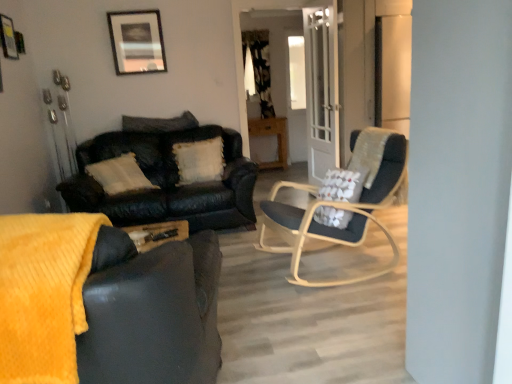
What do you see at coordinates (159, 123) in the screenshot? I see `fluffy white pillow at center, marked as the 1th pillow in a top-to-bottom arrangement` at bounding box center [159, 123].

Image resolution: width=512 pixels, height=384 pixels. I want to click on fluffy white pillow at center, the second pillow when ordered from bottom to top, so click(159, 123).

Describe the element at coordinates (259, 68) in the screenshot. I see `black textured curtain at upper center` at that location.

This screenshot has height=384, width=512. Identify the location of wooden table at center. (271, 134).

This screenshot has height=384, width=512. What do you see at coordinates (321, 91) in the screenshot?
I see `clear glass door at center` at bounding box center [321, 91].

I want to click on matte black couch at lower left, the 1th studio couch viewed from the front, so click(x=105, y=304).

Identify the location of matte black chair at center. (337, 209).

At what (x,y) coordinates should I click in order to perform the action: click on white fluffy pillow at center, the second pillow in the top-to-bottom sequence. Please return your answer as a coordinate pair (x, y). The height and width of the screenshot is (384, 512). Looking at the image, I should click on (199, 160).

Is wooden table at center surrounding white fluffy pillow at center, which is the 1th pillow in bottom-to-top order?

No, wooden table at center does not contain white fluffy pillow at center, which is the 1th pillow in bottom-to-top order.

Measure the distance from wooden table at center to white fluffy pillow at center, the second pillow in the top-to-bottom sequence.

The distance of wooden table at center from white fluffy pillow at center, the second pillow in the top-to-bottom sequence, is 2.23 meters.

Is wooden table at center bigger or smaller than white fluffy pillow at center, the second pillow in the top-to-bottom sequence?

Considering their sizes, wooden table at center takes up more space than white fluffy pillow at center, the second pillow in the top-to-bottom sequence.

Does matte black couch at lower left, the 1th studio couch viewed from the front, appear on the right side of matte black chair at center?

No, matte black couch at lower left, the 1th studio couch viewed from the front, is not to the right of matte black chair at center.

Is the depth of matte black couch at lower left, the 1th studio couch viewed from the front, less than that of matte black chair at center?

Yes, matte black couch at lower left, the 1th studio couch viewed from the front, is closer to the camera.

Can you confirm if matte black couch at lower left, the 1th studio couch viewed from the front, is taller than matte black chair at center?

Indeed, matte black couch at lower left, the 1th studio couch viewed from the front, has a greater height compared to matte black chair at center.

Identify the location of chair on the right side of matte black couch at lower left, the 1th studio couch viewed from the front. Image resolution: width=512 pixels, height=384 pixels. (337, 209).

Is wooden table at center with clear glass door at center?

They are not placed beside each other.

Considering the sizes of wooden table at center and clear glass door at center in the image, is wooden table at center bigger or smaller than clear glass door at center?

In the image, wooden table at center appears to be larger than clear glass door at center.

From a real-world perspective, is wooden table at center beneath clear glass door at center?

Yes, from a real-world perspective, wooden table at center is under clear glass door at center.

Consider the image. Can you confirm if wooden table at center is shorter than clear glass door at center?

Correct, wooden table at center is not as tall as clear glass door at center.

Considering the sizes of objects fluffy white pillow at center, the second pillow when ordered from bottom to top, and wooden table at center in the image provided, who is smaller, fluffy white pillow at center, the second pillow when ordered from bottom to top, or wooden table at center?

Smaller between the two is fluffy white pillow at center, the second pillow when ordered from bottom to top.

Can you confirm if fluffy white pillow at center, the second pillow when ordered from bottom to top, is thinner than wooden table at center?

Indeed, fluffy white pillow at center, the second pillow when ordered from bottom to top, has a lesser width compared to wooden table at center.

Which is more to the left, fluffy white pillow at center, marked as the 1th pillow in a top-to-bottom arrangement, or wooden table at center?

Positioned to the left is fluffy white pillow at center, marked as the 1th pillow in a top-to-bottom arrangement.

Does fluffy white pillow at center, the second pillow when ordered from bottom to top, have a lesser height compared to wooden table at center?

Yes.

From the image's perspective, is clear glass door at center positioned above or below matte black couch at lower left, positioned as the 2th studio couch in back-to-front order?

clear glass door at center is situated higher than matte black couch at lower left, positioned as the 2th studio couch in back-to-front order, in the image.

Which is more to the right, clear glass door at center or matte black couch at lower left, positioned as the 2th studio couch in back-to-front order?

clear glass door at center is more to the right.

Is point (327, 90) positioned in front of point (168, 298)?

No, (327, 90) is behind (168, 298).

How different are the orientations of clear glass door at center and matte black couch at lower left, positioned as the 2th studio couch in back-to-front order, in degrees?

The angle between the facing direction of clear glass door at center and the facing direction of matte black couch at lower left, positioned as the 2th studio couch in back-to-front order, is 107 degrees.

In the image, is white fluffy pillow at center, the second pillow in the top-to-bottom sequence, on the left side or the right side of black textured curtain at upper center?

white fluffy pillow at center, the second pillow in the top-to-bottom sequence, is positioned on black textured curtain at upper center's left side.

Is white fluffy pillow at center, the second pillow in the top-to-bottom sequence, facing towards black textured curtain at upper center?

No, white fluffy pillow at center, the second pillow in the top-to-bottom sequence, is not aimed at black textured curtain at upper center.

Is the position of white fluffy pillow at center, which is the 1th pillow in bottom-to-top order, less distant than that of black textured curtain at upper center?

Yes.

In the scene shown: From a real-world perspective, which object rests below the other?

leather couch at left, marked as the 2th studio couch in a front-to-back arrangement.

Is fluffy white pillow at center, marked as the 1th pillow in a top-to-bottom arrangement, turned away from leather couch at left, marked as the 2th studio couch in a front-to-back arrangement?

fluffy white pillow at center, marked as the 1th pillow in a top-to-bottom arrangement, does not have its back to leather couch at left, marked as the 2th studio couch in a front-to-back arrangement.

Does fluffy white pillow at center, marked as the 1th pillow in a top-to-bottom arrangement, have a greater height compared to leather couch at left, acting as the first studio couch starting from the back?

No.

Would you say fluffy white pillow at center, the second pillow when ordered from bottom to top, contains leather couch at left, marked as the 2th studio couch in a front-to-back arrangement?

No, leather couch at left, marked as the 2th studio couch in a front-to-back arrangement, is not a part of fluffy white pillow at center, the second pillow when ordered from bottom to top.

Locate an element on the screen. The image size is (512, 384). table on the right of the white fluffy pillow at center, the second pillow in the top-to-bottom sequence is located at coordinates (271, 134).

Identify the location of chair behind the matte black couch at lower left, the 1th studio couch viewed from the front. The width and height of the screenshot is (512, 384). (337, 209).

When comparing their distances from matte black chair at center, does leather couch at left, acting as the first studio couch starting from the back, or fluffy white pillow at center, the second pillow when ordered from bottom to top, seem further?

fluffy white pillow at center, the second pillow when ordered from bottom to top, is positioned further to the anchor matte black chair at center.

When comparing their distances from fluffy white pillow at center, marked as the 1th pillow in a top-to-bottom arrangement, does white fluffy pillow at center, which is the 1th pillow in bottom-to-top order, or clear glass door at center seem further?

clear glass door at center is further to fluffy white pillow at center, marked as the 1th pillow in a top-to-bottom arrangement.

From the image, which object appears to be farther from wooden table at center, leather couch at left, acting as the first studio couch starting from the back, or white fluffy pillow at center, which is the 1th pillow in bottom-to-top order?

leather couch at left, acting as the first studio couch starting from the back, lies further to wooden table at center than the other object.

Considering their positions, is clear glass door at center positioned closer to wooden table at center than matte black picture frame at upper center?

clear glass door at center is closer to wooden table at center.

From the image, which object appears to be nearer to matte black couch at lower left, positioned as the 2th studio couch in back-to-front order, matte black picture frame at upper center or clear glass door at center?

clear glass door at center lies closer to matte black couch at lower left, positioned as the 2th studio couch in back-to-front order, than the other object.

From the image, which object appears to be farther from matte black picture frame at upper center, fluffy white pillow at center, marked as the 1th pillow in a top-to-bottom arrangement, or white fluffy pillow at center, which is the 1th pillow in bottom-to-top order?

Among the two, white fluffy pillow at center, which is the 1th pillow in bottom-to-top order, is located further to matte black picture frame at upper center.

Which object lies further to the anchor point leather couch at left, marked as the 2th studio couch in a front-to-back arrangement, wooden table at center or matte black chair at center?

Based on the image, wooden table at center appears to be further to leather couch at left, marked as the 2th studio couch in a front-to-back arrangement.

Which object lies nearer to the anchor point black textured curtain at upper center, wooden table at center or clear glass door at center?

Among the two, wooden table at center is located nearer to black textured curtain at upper center.

At what (x,y) coordinates should I click in order to perform the action: click on chair between matte black couch at lower left, positioned as the 2th studio couch in back-to-front order, and matte black picture frame at upper center in the front-back direction. Please return your answer as a coordinate pair (x, y). Looking at the image, I should click on (337, 209).

I want to click on curtain between matte black chair at center and wooden table at center in the front-back direction, so click(259, 68).

Locate an element on the screen. This screenshot has width=512, height=384. curtain between fluffy white pillow at center, the second pillow when ordered from bottom to top, and wooden table at center in the front-back direction is located at coordinates (259, 68).

This screenshot has height=384, width=512. In order to click on curtain between matte black picture frame at upper center and wooden table at center from front to back in this screenshot , I will do `click(259, 68)`.